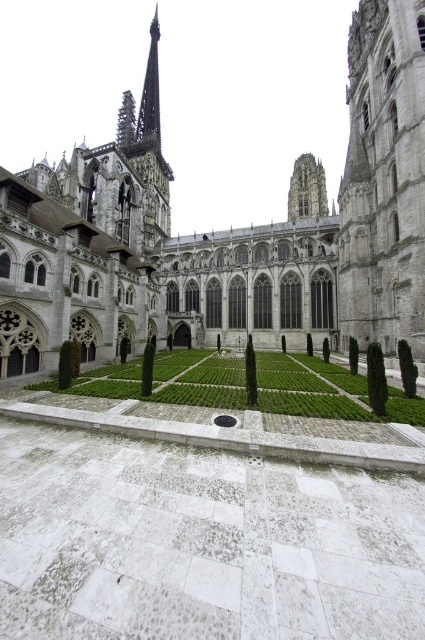
Can you confirm if green grass at center is positioned below white stone courtyard at center?

Incorrect, green grass at center is not positioned below white stone courtyard at center.

Does green grass at center have a smaller size compared to white stone courtyard at center?

Actually, green grass at center might be larger than white stone courtyard at center.

Does point (351, 74) come behind point (164, 547)?

Yes, it is.

Identify the location of green grass at center. (226, 230).